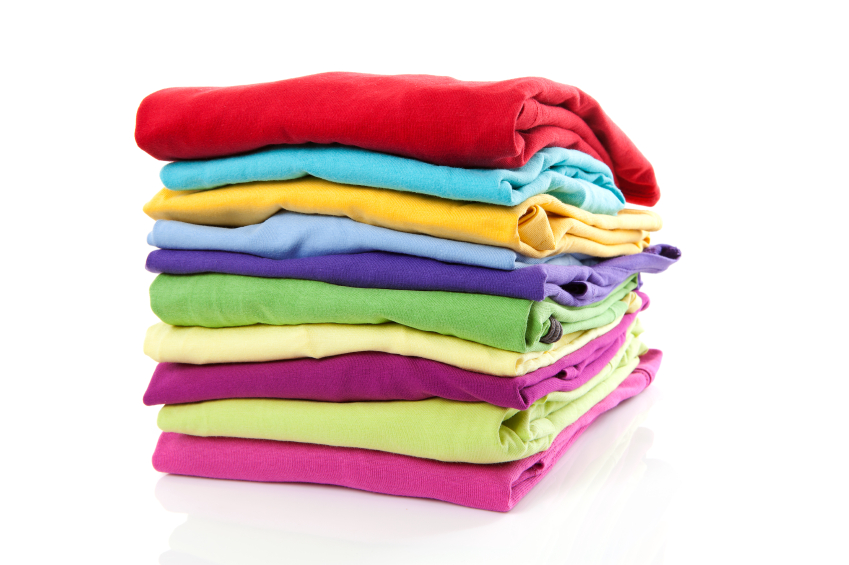
At what (x,y) coordinates should I click in order to perform the action: click on folded sheets. Please return your answer as a coordinate pair (x, y). The height and width of the screenshot is (565, 849). Looking at the image, I should click on (341, 108), (355, 166), (380, 207), (386, 237), (394, 267), (401, 305), (395, 346), (390, 369), (394, 432), (398, 473).